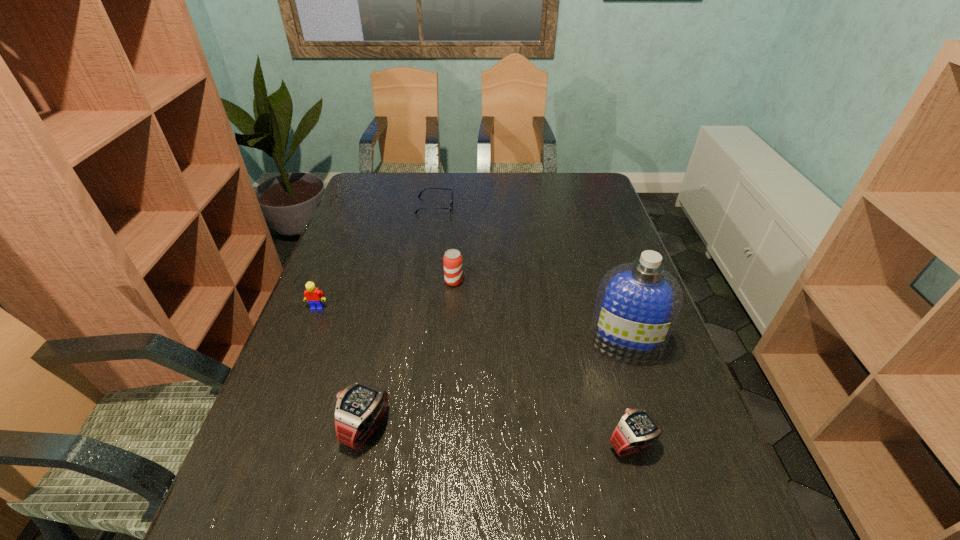
Identify the location of the taller watch. The width and height of the screenshot is (960, 540). click(360, 407).

Identify the location of the shorter watch. (637, 429).

Identify the location of the shortest object. The width and height of the screenshot is (960, 540). (450, 208).

The image size is (960, 540). I want to click on the farthest object, so click(450, 208).

Identify the location of beer can. The height and width of the screenshot is (540, 960). (453, 272).

The height and width of the screenshot is (540, 960). I want to click on the third nearest object, so click(x=637, y=305).

Where is `cleansing agent`? Image resolution: width=960 pixels, height=540 pixels. cleansing agent is located at coordinates (637, 305).

Find the location of `the third farthest object`. the third farthest object is located at coordinates (313, 295).

The width and height of the screenshot is (960, 540). I want to click on the leftmost object, so click(313, 295).

This screenshot has height=540, width=960. I want to click on blank space located on the right of the left watch, so click(465, 428).